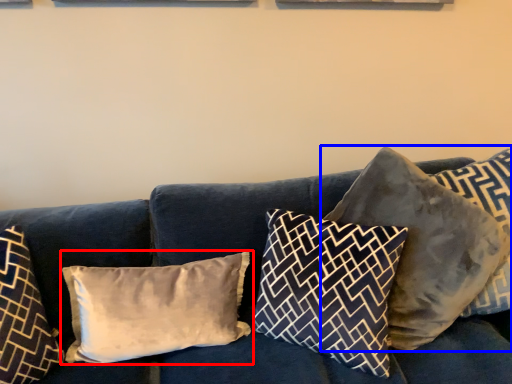
Question: Which of the following is the farthest to the observer, pillow (highlighted by a red box) or pillow (highlighted by a blue box)?

Choices:
 (A) pillow
 (B) pillow

Answer: (A)